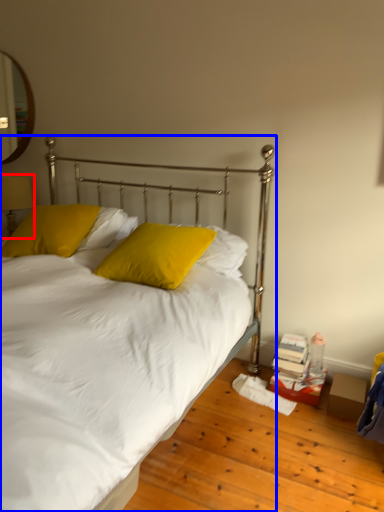
Question: Which of the following is the farthest to the observer, table lamp (highlighted by a red box) or bed (highlighted by a blue box)?

Choices:
 (A) table lamp
 (B) bed

Answer: (A)